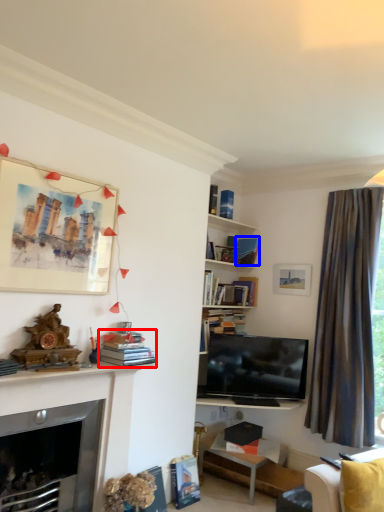
Question: Which object is further to the camera taking this photo, book (highlighted by a red box) or book (highlighted by a blue box)?

Choices:
 (A) book
 (B) book

Answer: (B)